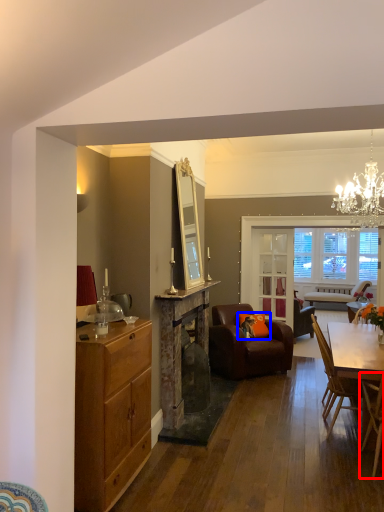
Question: Which of the following is the farthest to the observer, chair (highlighted by a red box) or pillow (highlighted by a blue box)?

Choices:
 (A) chair
 (B) pillow

Answer: (B)